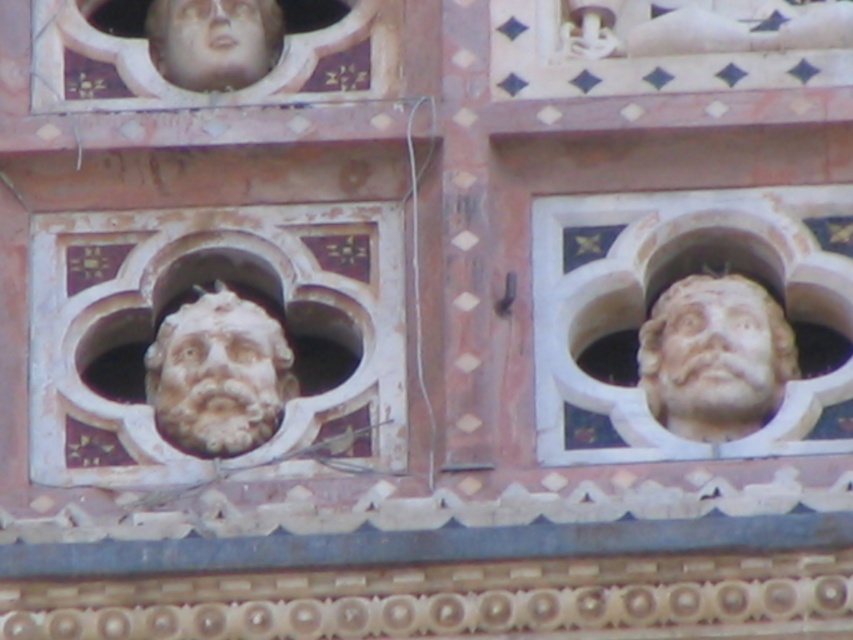
Question: Can you confirm if white stone face at center is bigger than smooth stone face at upper center?

Choices:
 (A) yes
 (B) no

Answer: (A)

Question: Considering the relative positions of white stone head at right and white stone face at center in the image provided, where is white stone head at right located with respect to white stone face at center?

Choices:
 (A) right
 (B) left

Answer: (A)

Question: Estimate the real-world distances between objects in this image. Which object is closer to the smooth stone face at upper center?

Choices:
 (A) white stone head at right
 (B) matte stone face at upper left

Answer: (B)

Question: Does white stone face at center appear on the right side of smooth stone face at upper center?

Choices:
 (A) no
 (B) yes

Answer: (B)

Question: Which object is the farthest from the white stone face at center?

Choices:
 (A) white marble head at right
 (B) white stone head at right

Answer: (B)

Question: Which object appears farthest from the camera in this image?

Choices:
 (A) smooth stone face at upper center
 (B) matte stone face at upper left
 (C) white stone face at center
 (D) white stone head at right

Answer: (B)